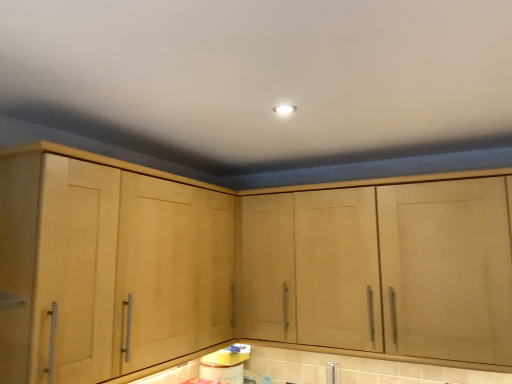
Measure the distance between point (x=340, y=378) and camera.

Point (x=340, y=378) and camera are 6.21 feet apart from each other.

What do you see at coordinates (384, 269) in the screenshot? I see `light wood cabinet at center, which ranks as the first cabinetry in right-to-left order` at bounding box center [384, 269].

This screenshot has width=512, height=384. Describe the element at coordinates (113, 259) in the screenshot. I see `light wood cabinet at left, the 2th cabinetry positioned from the right` at that location.

Where is `silver metallic faucet at lower center`? This screenshot has width=512, height=384. silver metallic faucet at lower center is located at coordinates (333, 372).

Does silver metallic faucet at lower center have a lesser width compared to light wood cabinet at center, which ranks as the first cabinetry in right-to-left order?

Yes.

Find the location of a particular element. The height and width of the screenshot is (384, 512). the 1st cabinetry above the silver metallic faucet at lower center (from the image's perspective) is located at coordinates (384, 269).

From a real-world perspective, is silver metallic faucet at lower center physically below light wood cabinet at center, which is the 2th cabinetry in left-to-right order?

Yes, from a real-world perspective, silver metallic faucet at lower center is below light wood cabinet at center, which is the 2th cabinetry in left-to-right order.

Between point (331, 362) and point (150, 248), which one is positioned in front?

The point (150, 248) is closer.

Can you see silver metallic faucet at lower center touching light wood cabinet at left, the 2th cabinetry positioned from the right?

There is a gap between silver metallic faucet at lower center and light wood cabinet at left, the 2th cabinetry positioned from the right.

From a real-world perspective, is silver metallic faucet at lower center physically located above or below light wood cabinet at left, the 2th cabinetry positioned from the right?

From a real-world perspective, silver metallic faucet at lower center is physically below light wood cabinet at left, the 2th cabinetry positioned from the right.

From a real-world perspective, which object stands above the other?

light wood cabinet at center, which is the 2th cabinetry in left-to-right order, is physically above.

Could you measure the distance between light wood cabinet at center, which is the 2th cabinetry in left-to-right order, and silver metallic faucet at lower center?

light wood cabinet at center, which is the 2th cabinetry in left-to-right order, is 20.63 inches away from silver metallic faucet at lower center.

Is light wood cabinet at center, which is the 2th cabinetry in left-to-right order, shorter than silver metallic faucet at lower center?

No.

Is light wood cabinet at center, which ranks as the first cabinetry in right-to-left order, at the left side of silver metallic faucet at lower center?

Incorrect, light wood cabinet at center, which ranks as the first cabinetry in right-to-left order, is not on the left side of silver metallic faucet at lower center.

Measure the distance from light wood cabinet at left, the 2th cabinetry positioned from the right, to silver metallic faucet at lower center.

light wood cabinet at left, the 2th cabinetry positioned from the right, and silver metallic faucet at lower center are 1.04 meters apart from each other.

Are light wood cabinet at left, which ranks as the first cabinetry in left-to-right order, and silver metallic faucet at lower center making contact?

No, light wood cabinet at left, which ranks as the first cabinetry in left-to-right order, is not touching silver metallic faucet at lower center.

From the image's perspective, is light wood cabinet at left, the 2th cabinetry positioned from the right, located above or below silver metallic faucet at lower center?

light wood cabinet at left, the 2th cabinetry positioned from the right, is situated higher than silver metallic faucet at lower center in the image.

Identify the location of faucet that is behind the light wood cabinet at left, the 2th cabinetry positioned from the right. Image resolution: width=512 pixels, height=384 pixels. (333, 372).

How different are the orientations of light wood cabinet at left, the 2th cabinetry positioned from the right, and light wood cabinet at center, which ranks as the first cabinetry in right-to-left order, in degrees?

The facing directions of light wood cabinet at left, the 2th cabinetry positioned from the right, and light wood cabinet at center, which ranks as the first cabinetry in right-to-left order, are 90.3 degrees apart.

Which is more to the left, light wood cabinet at left, which ranks as the first cabinetry in left-to-right order, or light wood cabinet at center, which is the 2th cabinetry in left-to-right order?

light wood cabinet at left, which ranks as the first cabinetry in left-to-right order, is more to the left.

Does point (163, 218) come in front of point (465, 191)?

No.

Would you say light wood cabinet at left, which ranks as the first cabinetry in left-to-right order, contains light wood cabinet at center, which is the 2th cabinetry in left-to-right order?

No, light wood cabinet at center, which is the 2th cabinetry in left-to-right order, is located outside of light wood cabinet at left, which ranks as the first cabinetry in left-to-right order.

Is light wood cabinet at center, which ranks as the first cabinetry in right-to-left order, surrounding light wood cabinet at left, the 2th cabinetry positioned from the right?

No.

Who is smaller, light wood cabinet at center, which ranks as the first cabinetry in right-to-left order, or light wood cabinet at left, the 2th cabinetry positioned from the right?

With smaller size is light wood cabinet at left, the 2th cabinetry positioned from the right.

Could you tell me if light wood cabinet at center, which ranks as the first cabinetry in right-to-left order, is turned towards light wood cabinet at left, which ranks as the first cabinetry in left-to-right order?

Yes, light wood cabinet at center, which ranks as the first cabinetry in right-to-left order, faces towards light wood cabinet at left, which ranks as the first cabinetry in left-to-right order.

Which point is more forward, (x=438, y=346) or (x=34, y=290)?

The point (x=34, y=290) is closer to the camera.

From the image's perspective, count 1st cabinetrys upward from the silver metallic faucet at lower center and point to it. Please provide its 2D coordinates.

[(384, 269)]

Find the location of `the 2nd cabinetry in front when counting from the silver metallic faucet at lower center`. the 2nd cabinetry in front when counting from the silver metallic faucet at lower center is located at coordinates (113, 259).

Considering their positions, is light wood cabinet at left, the 2th cabinetry positioned from the right, positioned further to light wood cabinet at center, which is the 2th cabinetry in left-to-right order, than silver metallic faucet at lower center?

Among the two, light wood cabinet at left, the 2th cabinetry positioned from the right, is located further to light wood cabinet at center, which is the 2th cabinetry in left-to-right order.

Looking at the image, which one is located further to silver metallic faucet at lower center, light wood cabinet at center, which is the 2th cabinetry in left-to-right order, or light wood cabinet at left, the 2th cabinetry positioned from the right?

light wood cabinet at left, the 2th cabinetry positioned from the right, lies further to silver metallic faucet at lower center than the other object.

Estimate the real-world distances between objects in this image. Which object is closer to silver metallic faucet at lower center, light wood cabinet at left, which ranks as the first cabinetry in left-to-right order, or light wood cabinet at center, which is the 2th cabinetry in left-to-right order?

light wood cabinet at center, which is the 2th cabinetry in left-to-right order, lies closer to silver metallic faucet at lower center than the other object.

Considering their positions, is light wood cabinet at center, which ranks as the first cabinetry in right-to-left order, positioned closer to light wood cabinet at left, which ranks as the first cabinetry in left-to-right order, than silver metallic faucet at lower center?

Among the two, light wood cabinet at center, which ranks as the first cabinetry in right-to-left order, is located nearer to light wood cabinet at left, which ranks as the first cabinetry in left-to-right order.

From the image, which object appears to be nearer to light wood cabinet at left, the 2th cabinetry positioned from the right, silver metallic faucet at lower center or light wood cabinet at center, which is the 2th cabinetry in left-to-right order?

light wood cabinet at center, which is the 2th cabinetry in left-to-right order, is positioned closer to the anchor light wood cabinet at left, the 2th cabinetry positioned from the right.

Which object lies nearer to the anchor point light wood cabinet at center, which ranks as the first cabinetry in right-to-left order, silver metallic faucet at lower center or light wood cabinet at left, the 2th cabinetry positioned from the right?

silver metallic faucet at lower center.

This screenshot has width=512, height=384. I want to click on faucet located between light wood cabinet at left, which ranks as the first cabinetry in left-to-right order, and light wood cabinet at center, which is the 2th cabinetry in left-to-right order, in the left-right direction, so click(x=333, y=372).